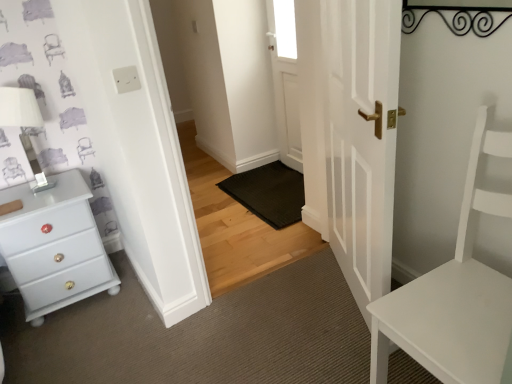
Question: In terms of size, does white wooden door at center, which is the 1th door in back-to-front order, appear bigger or smaller than white glossy door at center, the 1th door positioned from the front?

Choices:
 (A) small
 (B) big

Answer: (A)

Question: Relative to white glossy door at center, positioned as the 2th door in back-to-front order, is white wooden door at center, placed as the 2th door when sorted from front to back, in front or behind?

Choices:
 (A) front
 (B) behind

Answer: (B)

Question: Considering the real-world distances, which object is closest to the black rubber doormat at center?

Choices:
 (A) white wooden door at center, which is the 1th door in back-to-front order
 (B) matte white chest of drawers at left
 (C) transparent glass window at upper center
 (D) white matte chair at right
 (E) white glossy door at center, the 1th door positioned from the front

Answer: (A)

Question: Estimate the real-world distances between objects in this image. Which object is closer to the matte white chest of drawers at left?

Choices:
 (A) transparent glass window at upper center
 (B) white glossy door at center, the 1th door positioned from the front
 (C) white matte chair at right
 (D) white wooden door at center, which is the 1th door in back-to-front order
 (E) black rubber doormat at center

Answer: (E)